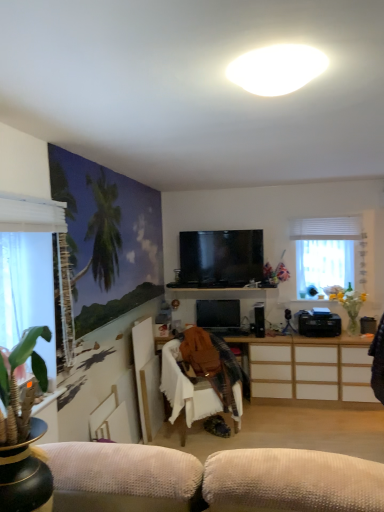
Question: In which direction should I rotate to look at matte black tv at center, acting as the first television starting from the bottom?

Choices:
 (A) left
 (B) right

Answer: (B)

Question: Is white matte oval light at upper center taller than white wood cabinet at center?

Choices:
 (A) yes
 (B) no

Answer: (B)

Question: Does white matte oval light at upper center appear on the left side of white wood cabinet at center?

Choices:
 (A) yes
 (B) no

Answer: (A)

Question: Is white matte oval light at upper center next to white wood cabinet at center and touching it?

Choices:
 (A) no
 (B) yes

Answer: (A)

Question: Does white matte oval light at upper center have a lesser width compared to white wood cabinet at center?

Choices:
 (A) yes
 (B) no

Answer: (A)

Question: Can you confirm if white matte oval light at upper center is wider than white wood cabinet at center?

Choices:
 (A) no
 (B) yes

Answer: (A)

Question: Is white matte oval light at upper center aimed at white wood cabinet at center?

Choices:
 (A) yes
 (B) no

Answer: (B)

Question: Considering the relative sizes of translucent glass vase at right and white sheer curtain at left, the second window viewed from the back, in the image provided, is translucent glass vase at right taller than white sheer curtain at left, the second window viewed from the back,?

Choices:
 (A) yes
 (B) no

Answer: (B)

Question: Is translucent glass vase at right aimed at white sheer curtain at left, the second window viewed from the back?

Choices:
 (A) yes
 (B) no

Answer: (B)

Question: Is translucent glass vase at right wider than white sheer curtain at left, which ranks as the first window in front-to-back order?

Choices:
 (A) no
 (B) yes

Answer: (B)

Question: Does translucent glass vase at right contain white sheer curtain at left, which ranks as the first window in front-to-back order?

Choices:
 (A) yes
 (B) no

Answer: (B)

Question: From the image's perspective, would you say translucent glass vase at right is positioned over white sheer curtain at left, which ranks as the first window in front-to-back order?

Choices:
 (A) no
 (B) yes

Answer: (A)

Question: From the image's perspective, does translucent glass vase at right appear lower than white sheer curtain at left, which ranks as the first window in front-to-back order?

Choices:
 (A) yes
 (B) no

Answer: (A)

Question: Is the position of translucent glass vase at right more distant than that of white fabric chair at center?

Choices:
 (A) yes
 (B) no

Answer: (A)